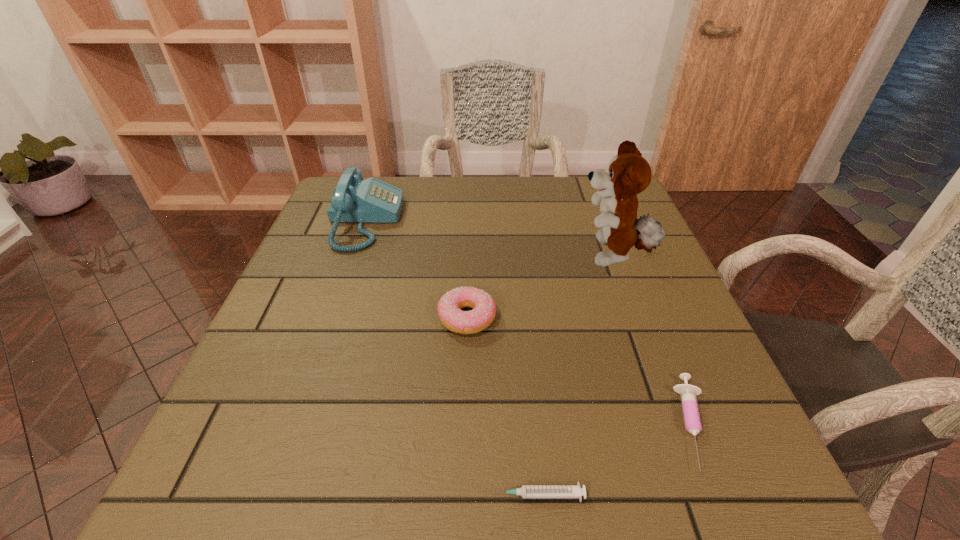
This screenshot has height=540, width=960. I want to click on blank space located on the face of the tallest object, so click(x=554, y=257).

You are a GUI agent. You are given a task and a screenshot of the screen. Output one action in this format:
    pyautogui.click(x=<x>, y=<y>)
    Task: Click on the vacant space situated 0.220m on the face of the tallest object
    This screenshot has height=540, width=960.
    Given the screenshot: What is the action you would take?
    pyautogui.click(x=482, y=257)

Image resolution: width=960 pixels, height=540 pixels. Find the location of `vacant area located on the dial of the leftmost object`. vacant area located on the dial of the leftmost object is located at coordinates point(473,221).

Identify the location of free location located 0.200m on the front of the doughnut. (463, 437).

Image resolution: width=960 pixels, height=540 pixels. I want to click on free region located 0.240m on the back of the taller syringe, so click(x=639, y=288).

At what (x,y) coordinates should I click in order to perform the action: click on free point located 0.080m at the needle end of the shortest object. Please return your answer as a coordinate pair (x, y). The width and height of the screenshot is (960, 540). Looking at the image, I should click on (434, 495).

Find the location of a particular element. The height and width of the screenshot is (540, 960). vacant space located at the needle end of the shortest object is located at coordinates (405, 495).

Where is `free region located 0.160m at the needle end of the shortest object`? free region located 0.160m at the needle end of the shortest object is located at coordinates (377, 495).

I want to click on object that is positioned at the far edge, so click(354, 200).

Locate an element on the screen. object that is positioned at the left edge is located at coordinates (354, 200).